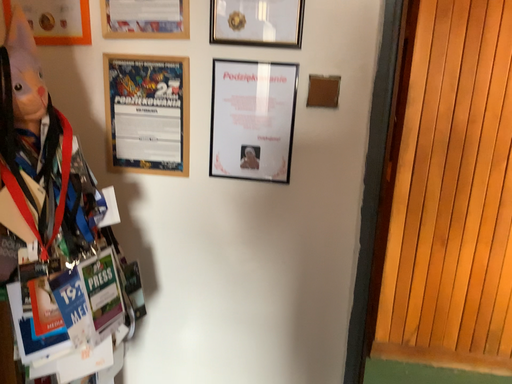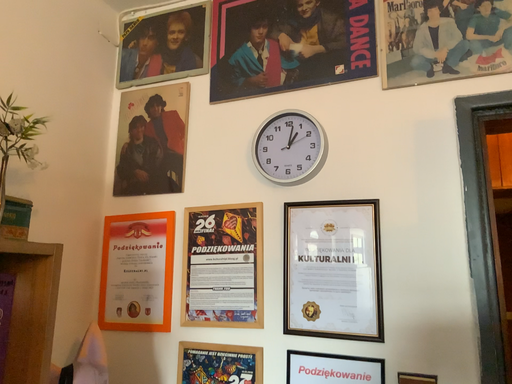
Question: How did the camera likely rotate when shooting the video?

Choices:
 (A) rotated downward
 (B) rotated upward

Answer: (B)